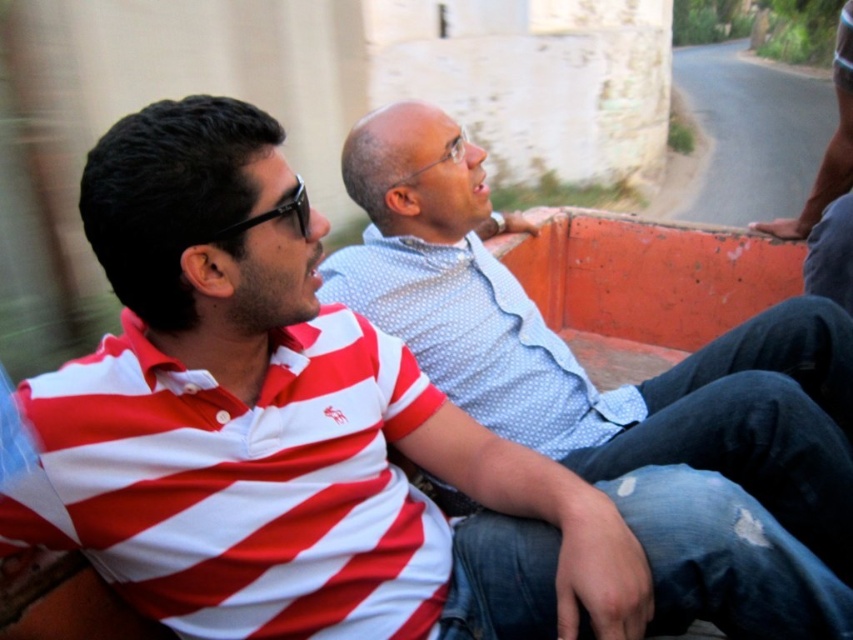
You are a photographer standing 2 meters away from the camera. You want to take a photo of the white dotted shirt at center. Can you reach it with a 1.5 meter long pole?

The white dotted shirt at center is 1.41 meters away from the camera. Since you are 2 meters away from the camera, the total distance between you and the white dotted shirt at center is 3.41 meters. The pole is only 1.5 meters long, so you cannot reach it.

You are a delivery person who needs to place a package between the white dotted shirt at center and the dark gray fabric pants at right. The package is 36 inches long. Will it fit without overlapping either?

The distance between the white dotted shirt at center and the dark gray fabric pants at right is 38.03 inches. Since the package is 36 inches long, it will fit without overlapping either.

You are a passenger in a moving vehicle and notice two people sitting in the back. The person on the left is wearing a red and white striped polo shirt, and the person on the right is wearing a light blue long sleeve shirt. There is a point marked at coordinates [479,339]. According to the coordinates, which person is closest to this point?

The point at [479,339] indicates the white dotted shirt at center, so the person closest to this point is the one wearing the red and white striped polo shirt at center.